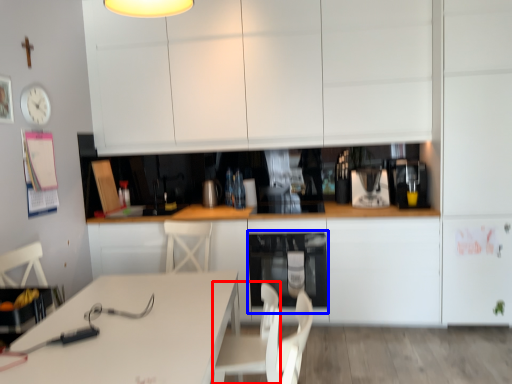
Question: Which object is further to the camera taking this photo, swivel chair (highlighted by a red box) or oven (highlighted by a blue box)?

Choices:
 (A) swivel chair
 (B) oven

Answer: (B)